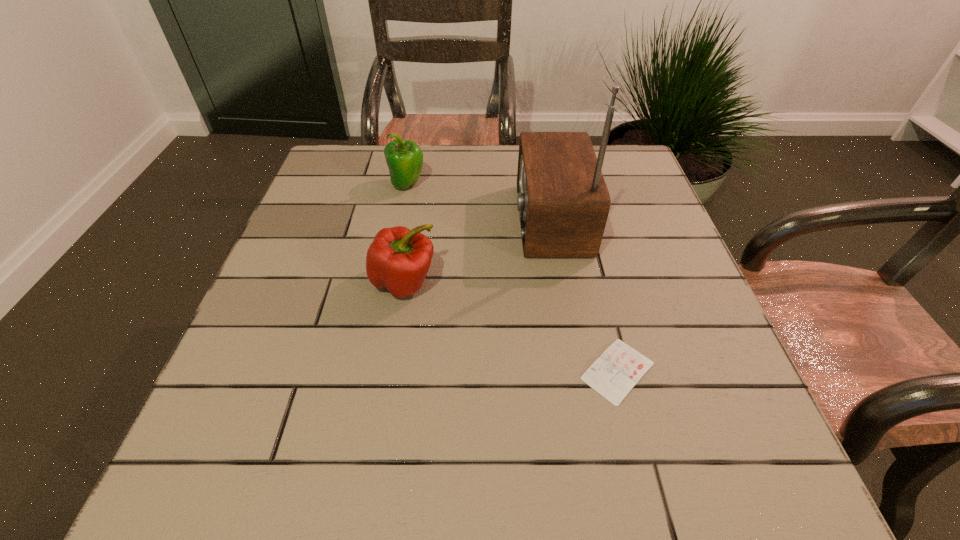
Where is `vacant space located on the right of the third shortest object`? The width and height of the screenshot is (960, 540). vacant space located on the right of the third shortest object is located at coordinates (513, 184).

Identify the location of free space located 0.320m on the right of the nearer bell pepper. (589, 282).

Find the location of a particular element. The height and width of the screenshot is (540, 960). free region located on the right of the shortest object is located at coordinates pos(725,371).

Locate an element on the screen. The image size is (960, 540). radio receiver that is positioned at the far edge is located at coordinates pos(563,202).

Where is `bell pepper situated at the far edge`? bell pepper situated at the far edge is located at coordinates (404, 159).

Find the location of a particular element. object that is at the right edge is located at coordinates pos(620,367).

In the image, there is a desktop. At what (x,y) coordinates should I click in order to perform the action: click on free space at the far edge. Please return your answer as a coordinate pair (x, y). The width and height of the screenshot is (960, 540). Looking at the image, I should click on (410, 192).

You are a GUI agent. You are given a task and a screenshot of the screen. Output one action in this format:
    pyautogui.click(x=<x>, y=<y>)
    Task: Click on the vacant space at the near edge
    
    Given the screenshot: What is the action you would take?
    pyautogui.click(x=564, y=443)

The height and width of the screenshot is (540, 960). In the image, there is a desktop. In order to click on vacant space at the left edge in this screenshot , I will do `click(255, 367)`.

In the image, there is a desktop. Find the location of `vacant space at the right edge`. vacant space at the right edge is located at coordinates (648, 341).